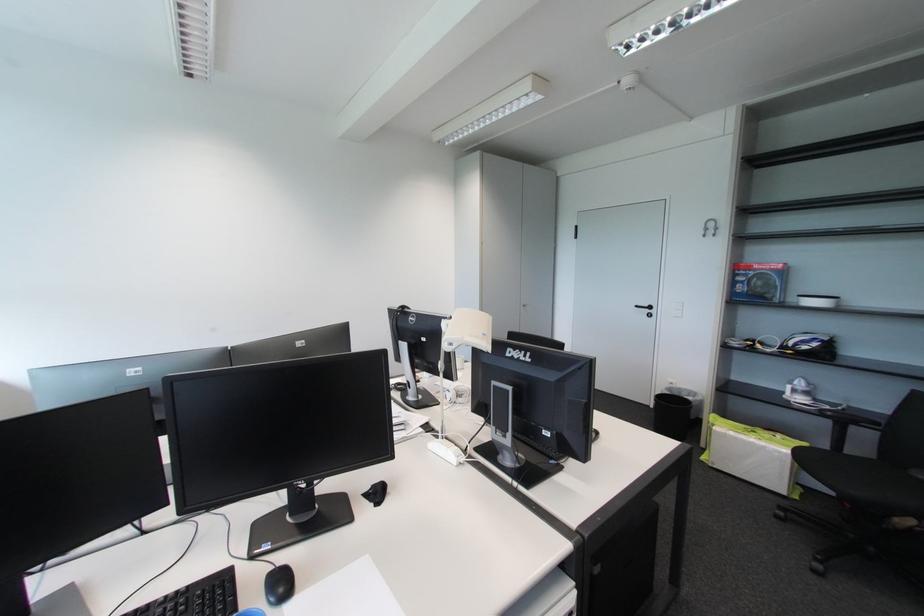
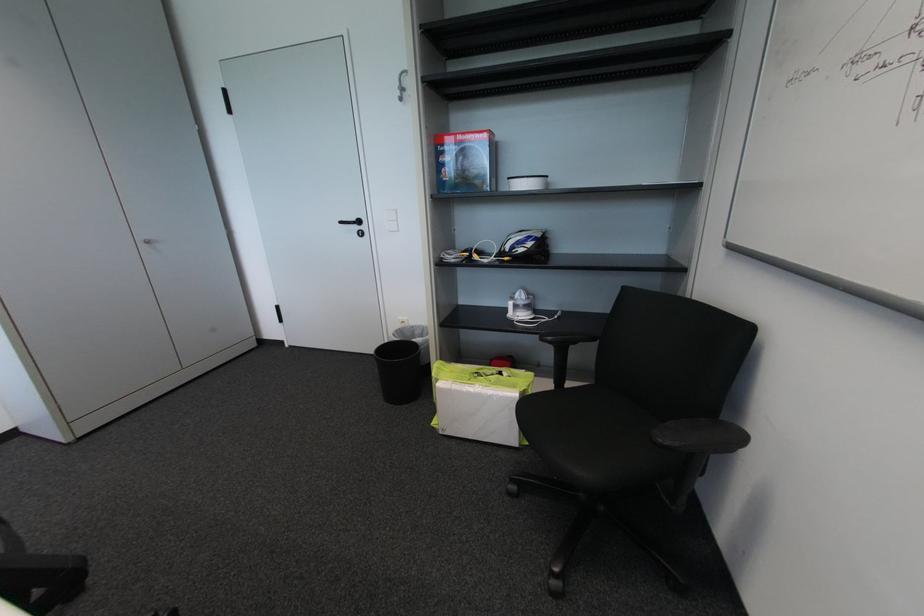
Where in the second image is the point corresponding to the point at 529,309 from the first image?

(151, 246)